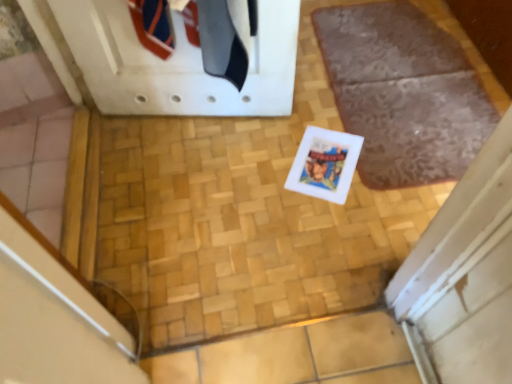
I want to click on free region on the left part of brown textured mat at center, so click(245, 160).